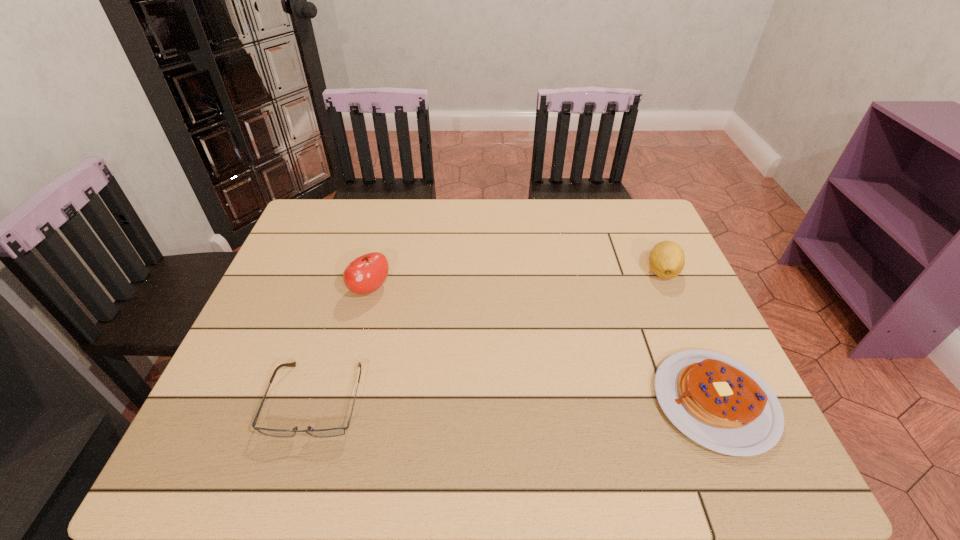
You are a GUI agent. You are given a task and a screenshot of the screen. Output one action in this format:
    pyautogui.click(x=<x>, y=<y>)
    Task: Click on the vacant space at the left edge of the desktop
    This screenshot has width=960, height=540.
    Given the screenshot: What is the action you would take?
    pyautogui.click(x=303, y=287)

Identify the location of vacant space at the right edge of the desktop. The height and width of the screenshot is (540, 960). (660, 331).

Where is `vacant region at the far left corner of the desktop`? Image resolution: width=960 pixels, height=540 pixels. vacant region at the far left corner of the desktop is located at coordinates click(311, 221).

Find the location of `unoccupied area between the pancake and the apple`. unoccupied area between the pancake and the apple is located at coordinates (542, 346).

This screenshot has width=960, height=540. Find the location of `empty space that is in between the spectacles and the apple`. empty space that is in between the spectacles and the apple is located at coordinates (344, 345).

Identify the location of vacant point located between the second tallest object and the shortest object. Image resolution: width=960 pixels, height=540 pixels. (490, 335).

You are a GUI agent. You are given a task and a screenshot of the screen. Output one action in this format:
    pyautogui.click(x=<x>, y=<y>)
    Task: Click on the vacant area that lies between the pancake and the shortest object
    The width and height of the screenshot is (960, 540).
    Given the screenshot: What is the action you would take?
    pyautogui.click(x=516, y=401)

I want to click on free space between the pancake and the shortest object, so click(516, 401).

The height and width of the screenshot is (540, 960). In order to click on free space between the pancake and the apple in this screenshot , I will do `click(542, 346)`.

Identify the location of free space that is in between the apple and the pancake. (542, 346).